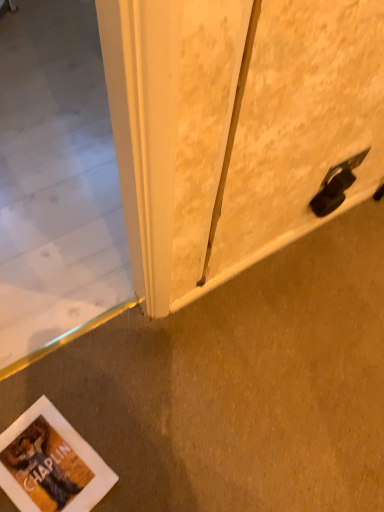
The height and width of the screenshot is (512, 384). Describe the element at coordinates (297, 121) in the screenshot. I see `matte white screen door at right` at that location.

Locate an element on the screen. The height and width of the screenshot is (512, 384). matte white screen door at right is located at coordinates (297, 121).

In order to click on white matte concrete at lower left in this screenshot , I will do `click(239, 385)`.

Describe the element at coordinates (239, 385) in the screenshot. This screenshot has height=512, width=384. I see `white matte concrete at lower left` at that location.

This screenshot has height=512, width=384. Find the location of `matte white screen door at right`. matte white screen door at right is located at coordinates (297, 121).

Which is more to the left, white matte concrete at lower left or matte white screen door at right?

From the viewer's perspective, white matte concrete at lower left appears more on the left side.

Is white matte concrete at lower left positioned behind matte white screen door at right?

Yes, the depth of white matte concrete at lower left is greater than that of matte white screen door at right.

Which is behind, point (231, 365) or point (259, 224)?

The point (231, 365) is farther from the camera.

From the image's perspective, which one is positioned lower, white matte concrete at lower left or matte white screen door at right?

white matte concrete at lower left is shown below in the image.

From a real-world perspective, which object rests below the other?

white matte concrete at lower left, from a real-world perspective.

Considering the sizes of objects white matte concrete at lower left and matte white screen door at right in the image provided, who is thinner, white matte concrete at lower left or matte white screen door at right?

With smaller width is matte white screen door at right.

Considering the sizes of objects white matte concrete at lower left and matte white screen door at right in the image provided, who is shorter, white matte concrete at lower left or matte white screen door at right?

With less height is white matte concrete at lower left.

Is white matte concrete at lower left bigger or smaller than matte white screen door at right?

Considering their sizes, white matte concrete at lower left takes up more space than matte white screen door at right.

Is white matte concrete at lower left situated inside matte white screen door at right or outside?

The correct answer is: outside.

Is white matte concrete at lower left not close to matte white screen door at right?

Actually, white matte concrete at lower left and matte white screen door at right are a little close together.

Is white matte concrete at lower left facing away from matte white screen door at right?

No, white matte concrete at lower left's orientation is not away from matte white screen door at right.

You are a GUI agent. You are given a task and a screenshot of the screen. Output one action in this format:
    pyautogui.click(x=<x>, y=<y>)
    Task: Click on the screen door on the right of the white matte concrete at lower left
    
    Given the screenshot: What is the action you would take?
    pyautogui.click(x=297, y=121)

Considering the relative positions of matte white screen door at right and white matte concrete at lower left in the image provided, is matte white screen door at right to the left or to the right of white matte concrete at lower left?

matte white screen door at right is to the right of white matte concrete at lower left.

Is matte white screen door at right positioned behind white matte concrete at lower left?

No.

Which is in front, point (303, 226) or point (342, 472)?

The point (342, 472) is closer.

From the image's perspective, is matte white screen door at right above or below white matte concrete at lower left?

Clearly, from the image's perspective, matte white screen door at right is above white matte concrete at lower left.

From a real-world perspective, which is physically below, matte white screen door at right or white matte concrete at lower left?

white matte concrete at lower left is physically lower.

Which object is wider, matte white screen door at right or white matte concrete at lower left?

white matte concrete at lower left is wider.

In terms of height, does matte white screen door at right look taller or shorter compared to white matte concrete at lower left?

In the image, matte white screen door at right appears to be taller than white matte concrete at lower left.

Based on the photo, who is smaller, matte white screen door at right or white matte concrete at lower left?

With smaller size is matte white screen door at right.

Is matte white screen door at right located outside white matte concrete at lower left?

Indeed, matte white screen door at right is completely outside white matte concrete at lower left.

From the picture: Is matte white screen door at right with white matte concrete at lower left?

No, matte white screen door at right is not beside white matte concrete at lower left.

Could you tell me if matte white screen door at right is facing white matte concrete at lower left?

No, matte white screen door at right does not turn towards white matte concrete at lower left.

In the scene shown: Can you tell me how much matte white screen door at right and white matte concrete at lower left differ in facing direction?

The angular difference between matte white screen door at right and white matte concrete at lower left is 179 degrees.

Image resolution: width=384 pixels, height=512 pixels. What are the coordinates of `concrete that is on the left side of matte white screen door at right` in the screenshot? It's located at (239, 385).

This screenshot has height=512, width=384. Identify the location of concrete that is below the matte white screen door at right (from the image's perspective). (239, 385).

Identify the location of screen door above the white matte concrete at lower left (from the image's perspective). (297, 121).